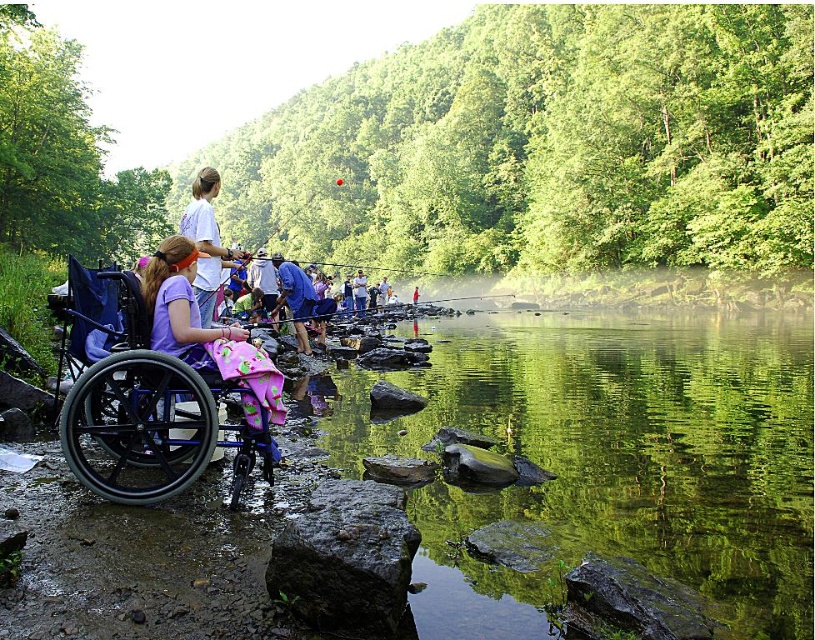
Does matte purple shirt at center appear on the left side of blue fabric at center?

No, matte purple shirt at center is not to the left of blue fabric at center.

Does point (164, 292) come behind point (297, 282)?

No, (164, 292) is in front of (297, 282).

The height and width of the screenshot is (640, 815). I want to click on matte purple shirt at center, so click(179, 305).

Which of these two, green smooth water at center or blue fabric at center, stands shorter?

Standing shorter between the two is green smooth water at center.

Does green smooth water at center have a greater width compared to blue fabric at center?

Indeed, green smooth water at center has a greater width compared to blue fabric at center.

Between point (474, 572) and point (294, 310), which one is positioned behind?

The point (294, 310) is behind.

The height and width of the screenshot is (640, 815). I want to click on green smooth water at center, so click(x=606, y=458).

Can you confirm if green smooth water at center is bigger than matte purple shirt at center?

Yes, green smooth water at center is bigger than matte purple shirt at center.

The image size is (815, 640). I want to click on green smooth water at center, so 606,458.

Identify the location of green smooth water at center. The width and height of the screenshot is (815, 640). (606, 458).